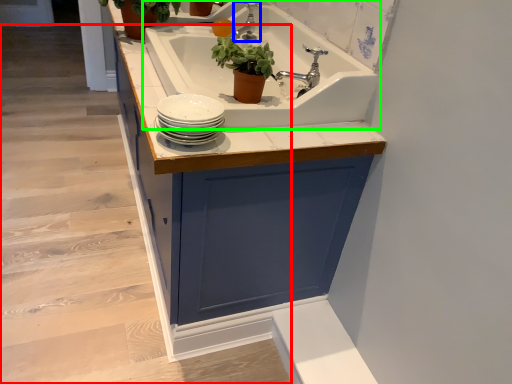
Question: Estimate the real-world distances between objects in this image. Which object is farther from stairwell (highlighted by a red box), tap (highlighted by a blue box) or sink (highlighted by a green box)?

Choices:
 (A) tap
 (B) sink

Answer: (A)